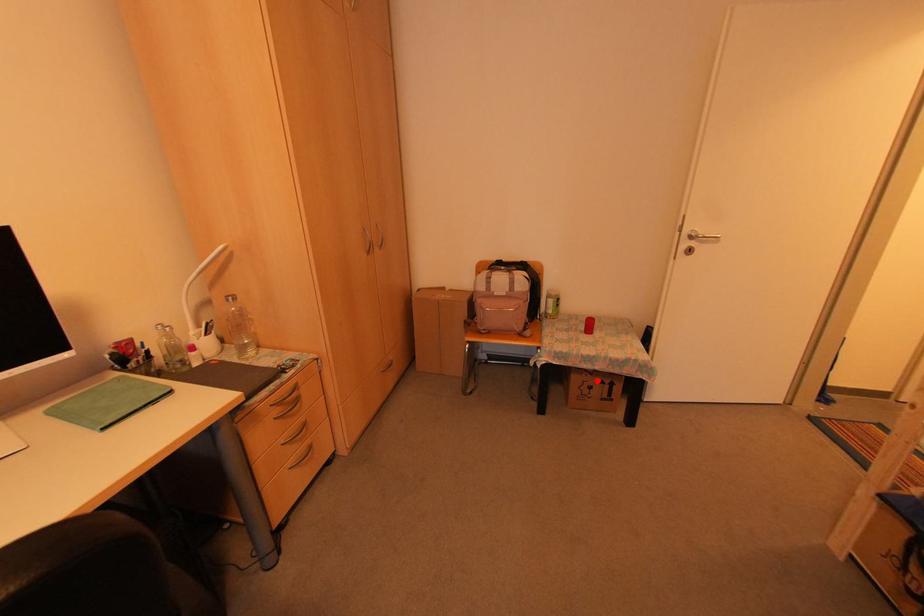
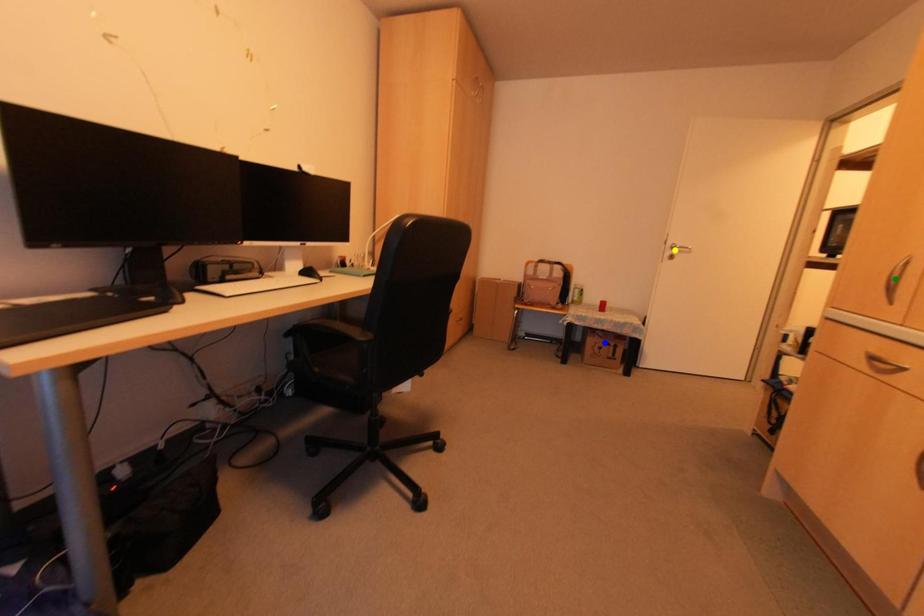
Question: I am providing you with two images of the same scene from different viewpoints. A red point is marked on the first image. You are given multiple points on the second image. Which point in image 2 is actually the same real-world point as the red point in image 1?

Choices:
 (A) yellow point
 (B) blue point
 (C) green point

Answer: (B)